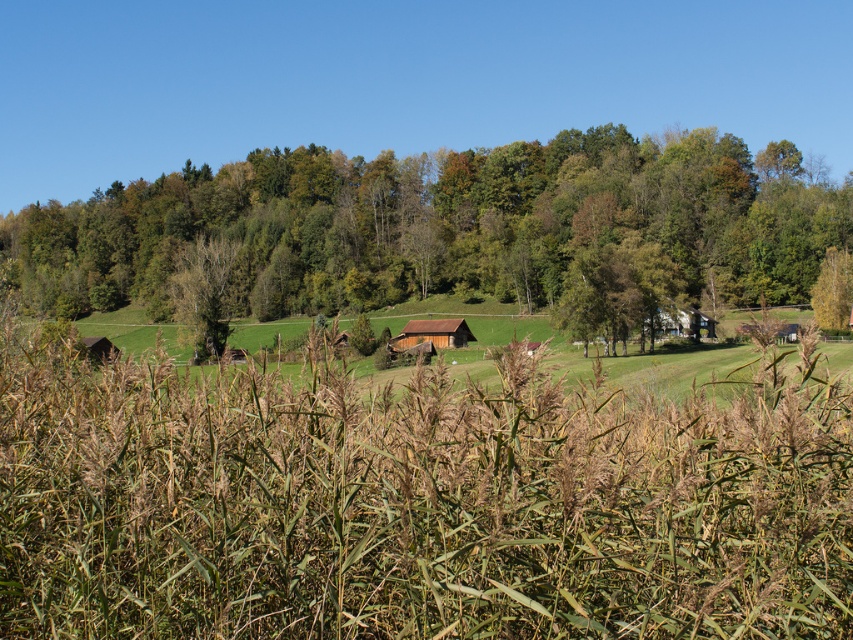
Who is positioned more to the left, green matte tree at center or brown wooden hut at center?

green matte tree at center

Looking at this image, who is more forward, (202,250) or (428,324)?

Point (428,324) is more forward.

The height and width of the screenshot is (640, 853). I want to click on green matte tree at center, so click(x=202, y=292).

Does green leafy tree at center appear over green leafy tree at right?

Correct, green leafy tree at center is located above green leafy tree at right.

Is green leafy tree at center positioned behind green leafy tree at right?

No, it is not.

Describe the element at coordinates (451, 228) in the screenshot. I see `green leafy tree at center` at that location.

The width and height of the screenshot is (853, 640). Identify the location of green leafy tree at center. (451, 228).

Between brown wooden hut at center and white wooden hut at center-right, which one has more height?

Standing taller between the two is white wooden hut at center-right.

Does brown wooden hut at center have a greater width compared to white wooden hut at center-right?

Indeed, brown wooden hut at center has a greater width compared to white wooden hut at center-right.

Identify the location of brown wooden hut at center. Image resolution: width=853 pixels, height=640 pixels. (432, 333).